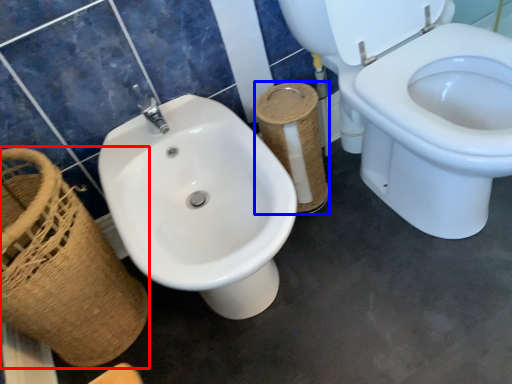
Question: Which of the following is the closest to the observer, basket (highlighted by a red box) or toilet paper (highlighted by a blue box)?

Choices:
 (A) basket
 (B) toilet paper

Answer: (A)